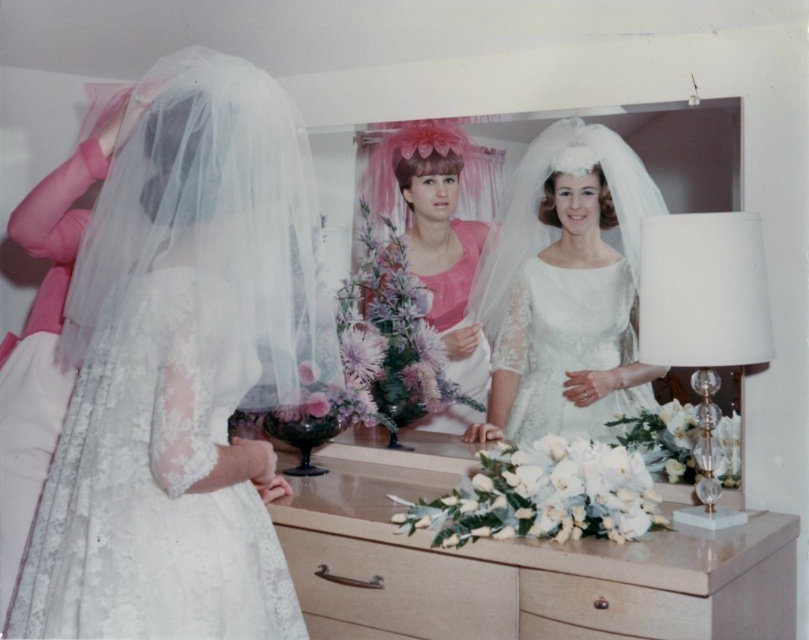
Question: Which point appears closest to the camera in this image?

Choices:
 (A) (473, 166)
 (B) (515, 243)
 (C) (551, 609)
 (D) (566, 404)

Answer: (C)

Question: Is wooden dresser at center further to the viewer compared to lace white dress at center?

Choices:
 (A) no
 (B) yes

Answer: (A)

Question: Which object appears farthest from the camera in this image?

Choices:
 (A) pink satin dress at center
 (B) white lace dress at center
 (C) beige wood drawer at lower center
 (D) light wood drawer at lower center

Answer: (A)

Question: Which object is positioned closest to the white lace dress at center?

Choices:
 (A) white glass lamp at right
 (B) wooden dresser at center
 (C) lace white dress at center

Answer: (C)

Question: Can you confirm if lace white dress at center is thinner than white lace dress at center?

Choices:
 (A) no
 (B) yes

Answer: (A)

Question: Can you confirm if lace fabric dress at center is thinner than light wood drawer at lower center?

Choices:
 (A) yes
 (B) no

Answer: (B)